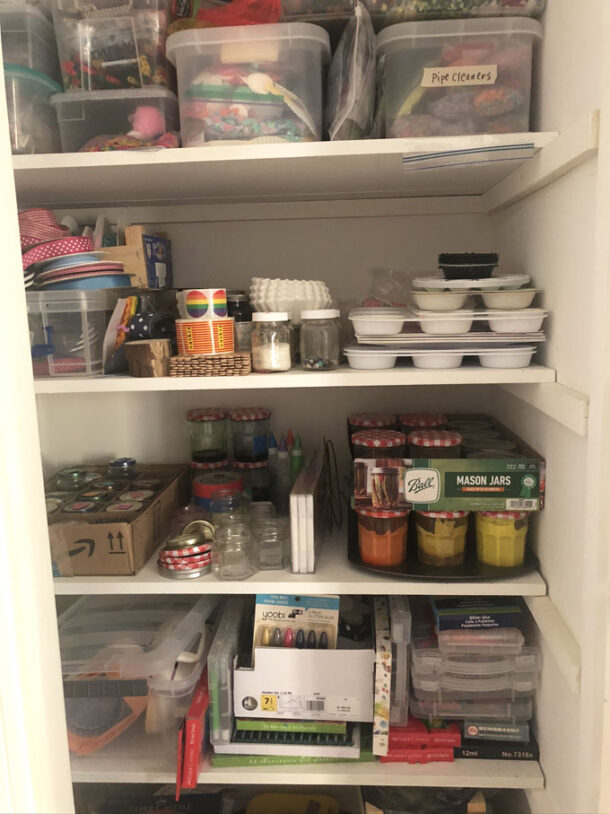
Find the location of `plastic storage bin`. plastic storage bin is located at coordinates (127, 720), (481, 685), (481, 699), (496, 667), (73, 331), (253, 84), (496, 107), (106, 27), (26, 110).